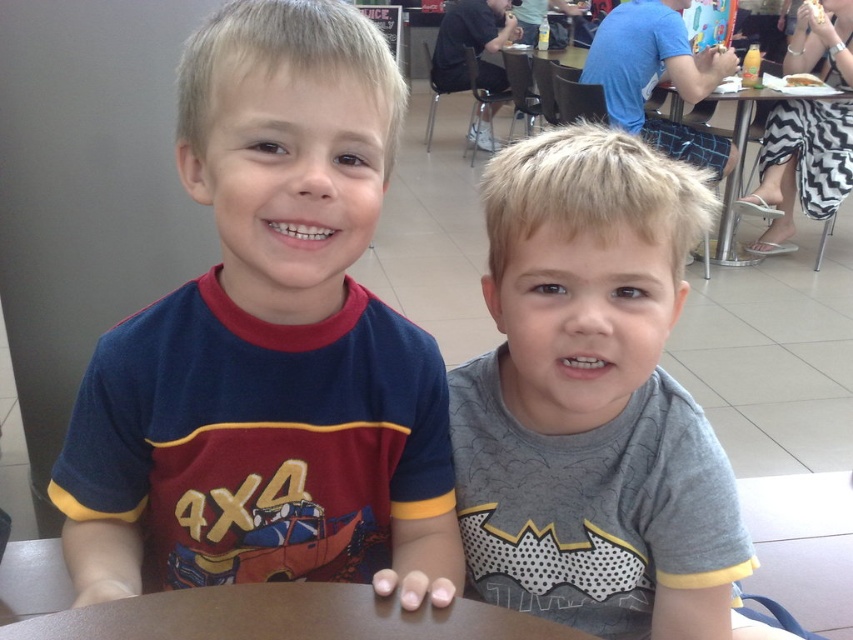
Which is in front, point (259, 106) or point (751, 253)?

Point (259, 106) is more forward.

Can you confirm if maroon fabric shirt at center is positioned below metallic silver table at center?

Correct, maroon fabric shirt at center is located below metallic silver table at center.

Identify the location of maroon fabric shirt at center. (270, 342).

Is black and white zigzag dress at right smaller than metallic silver table at center?

Indeed, black and white zigzag dress at right has a smaller size compared to metallic silver table at center.

From the picture: Does black and white zigzag dress at right appear under metallic silver table at center?

No.

Who is more distant from viewer, (x=769, y=120) or (x=755, y=92)?

Positioned behind is point (x=769, y=120).

Where is `black and white zigzag dress at right`? black and white zigzag dress at right is located at coordinates (799, 168).

Can you confirm if maroon fabric shirt at center is positioned to the left of gray cotton shirt at center?

Yes, maroon fabric shirt at center is to the left of gray cotton shirt at center.

Who is positioned more to the right, maroon fabric shirt at center or gray cotton shirt at center?

Positioned to the right is gray cotton shirt at center.

Which is behind, point (230, 256) or point (515, 189)?

The point (515, 189) is behind.

Find the location of `maroon fabric shirt at center`. maroon fabric shirt at center is located at coordinates (270, 342).